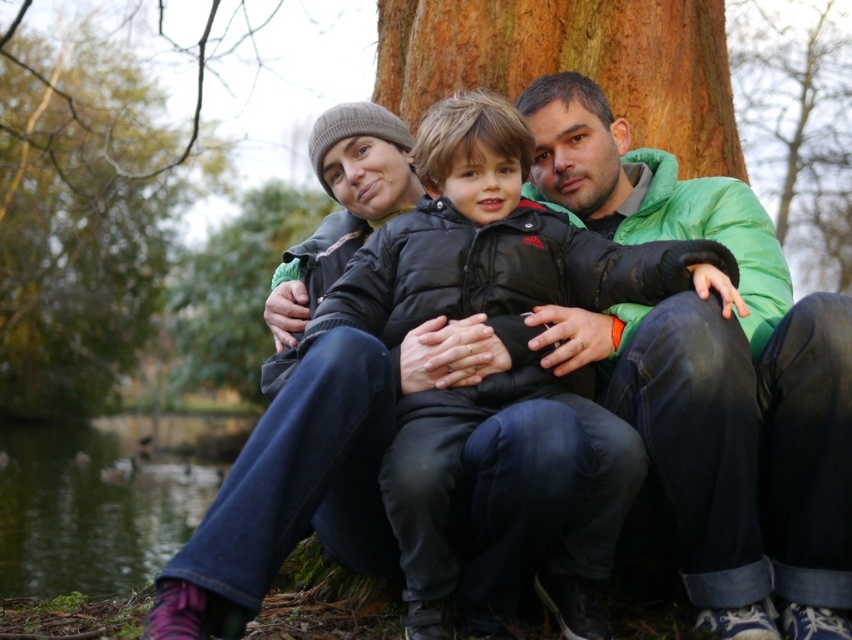
Can you confirm if black puffer jacket at center is positioned to the left of brown rough tree trunk at upper center?

No, black puffer jacket at center is not to the left of brown rough tree trunk at upper center.

Does black puffer jacket at center have a greater width compared to brown rough tree trunk at upper center?

Indeed, black puffer jacket at center has a greater width compared to brown rough tree trunk at upper center.

Describe the element at coordinates (496, 330) in the screenshot. I see `black puffer jacket at center` at that location.

Where is `black puffer jacket at center`? The height and width of the screenshot is (640, 852). black puffer jacket at center is located at coordinates (496, 330).

Which is more to the left, green matte jacket at center or brown rough tree trunk at upper center?

brown rough tree trunk at upper center is more to the left.

Does green matte jacket at center appear under brown rough tree trunk at upper center?

Yes.

What do you see at coordinates (711, 376) in the screenshot? The image size is (852, 640). I see `green matte jacket at center` at bounding box center [711, 376].

Locate an element on the screen. green matte jacket at center is located at coordinates (711, 376).

Is black puffer jacket at center closer to the viewer compared to green matte tree trunk at upper center?

Yes, it is in front of green matte tree trunk at upper center.

Which is in front, point (494, 145) or point (812, 276)?

Point (494, 145) is in front.

The image size is (852, 640). What do you see at coordinates (496, 330) in the screenshot?
I see `black puffer jacket at center` at bounding box center [496, 330].

Where is `black puffer jacket at center`? Image resolution: width=852 pixels, height=640 pixels. black puffer jacket at center is located at coordinates (496, 330).